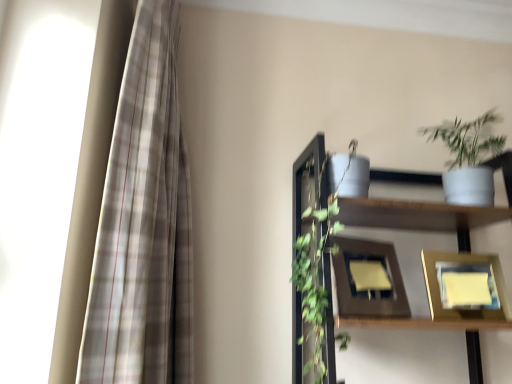
I want to click on wooden picture frame at center, the first picture frame when ordered from left to right, so click(x=368, y=280).

The height and width of the screenshot is (384, 512). What do you see at coordinates (419, 215) in the screenshot?
I see `white matte shelf at upper right` at bounding box center [419, 215].

The width and height of the screenshot is (512, 384). Find the location of `wooden picture frame at center, positioned as the second picture frame in right-to-left order`. wooden picture frame at center, positioned as the second picture frame in right-to-left order is located at coordinates (368, 280).

From a real-world perspective, is white matte shelf at upper right above or below plaid fabric curtain at left?

From a real-world perspective, white matte shelf at upper right is physically below plaid fabric curtain at left.

From the image's perspective, is white matte shelf at upper right over plaid fabric curtain at left?

No, from the image's perspective, white matte shelf at upper right is not over plaid fabric curtain at left.

Can you confirm if white matte shelf at upper right is taller than plaid fabric curtain at left?

Incorrect, the height of white matte shelf at upper right is not larger of that of plaid fabric curtain at left.

Locate an element on the screen. curtain that is above the white matte shelf at upper right (from a real-world perspective) is located at coordinates (143, 223).

Where is `picture frame that is the 2nd object located below the plaid fabric curtain at left (from the image's perspective)`? picture frame that is the 2nd object located below the plaid fabric curtain at left (from the image's perspective) is located at coordinates (465, 286).

Could you tell me if gold metallic picture frame at lower right, positioned as the second picture frame in left-to-right order, is turned towards plaid fabric curtain at left?

No, gold metallic picture frame at lower right, positioned as the second picture frame in left-to-right order, is not aimed at plaid fabric curtain at left.

Which object is closer to the camera taking this photo, gold metallic picture frame at lower right, which is the first picture frame in right-to-left order, or plaid fabric curtain at left?

plaid fabric curtain at left.

Does point (500, 291) come in front of point (142, 371)?

No, it is not.

From the image's perspective, which is above, wooden picture frame at center, positioned as the second picture frame in right-to-left order, or gold metallic picture frame at lower right, which is the first picture frame in right-to-left order?

From the image's view, wooden picture frame at center, positioned as the second picture frame in right-to-left order, is above.

Is wooden picture frame at center, positioned as the second picture frame in right-to-left order, wider or thinner than gold metallic picture frame at lower right, which is the first picture frame in right-to-left order?

Considering their sizes, wooden picture frame at center, positioned as the second picture frame in right-to-left order, looks slimmer than gold metallic picture frame at lower right, which is the first picture frame in right-to-left order.

This screenshot has width=512, height=384. There is a gold metallic picture frame at lower right, which is the first picture frame in right-to-left order. Identify the location of picture frame above it (from a real-world perspective). (368, 280).

Is gold metallic picture frame at lower right, which is the first picture frame in right-to-left order, inside wooden picture frame at center, the first picture frame when ordered from left to right?

No, wooden picture frame at center, the first picture frame when ordered from left to right, does not contain gold metallic picture frame at lower right, which is the first picture frame in right-to-left order.

Are white matte shelf at upper right and wooden picture frame at center, the first picture frame when ordered from left to right, far apart?

They are positioned close to each other.

What's the angular difference between white matte shelf at upper right and wooden picture frame at center, positioned as the second picture frame in right-to-left order,'s facing directions?

The facing directions of white matte shelf at upper right and wooden picture frame at center, positioned as the second picture frame in right-to-left order, are 24 degrees apart.

Does white matte shelf at upper right turn towards wooden picture frame at center, the first picture frame when ordered from left to right?

Yes, white matte shelf at upper right is oriented towards wooden picture frame at center, the first picture frame when ordered from left to right.

Does white matte shelf at upper right contain wooden picture frame at center, the first picture frame when ordered from left to right?

Yes, wooden picture frame at center, the first picture frame when ordered from left to right, is a part of white matte shelf at upper right.

Locate an element on the screen. The height and width of the screenshot is (384, 512). the 1st picture frame below the white matte pot at upper right (from the image's perspective) is located at coordinates (368, 280).

In the scene shown: Considering the relative sizes of wooden picture frame at center, positioned as the second picture frame in right-to-left order, and white matte pot at upper right in the image provided, is wooden picture frame at center, positioned as the second picture frame in right-to-left order, wider than white matte pot at upper right?

No, wooden picture frame at center, positioned as the second picture frame in right-to-left order, is not wider than white matte pot at upper right.

From a real-world perspective, is wooden picture frame at center, the first picture frame when ordered from left to right, below white matte pot at upper right?

Yes, from a real-world perspective, wooden picture frame at center, the first picture frame when ordered from left to right, is beneath white matte pot at upper right.

From the image's perspective, is wooden picture frame at center, positioned as the second picture frame in right-to-left order, on top of white matte pot at upper right?

No, from the image's perspective, wooden picture frame at center, positioned as the second picture frame in right-to-left order, is not on top of white matte pot at upper right.

Considering the sizes of plaid fabric curtain at left and white matte shelf at upper right in the image, is plaid fabric curtain at left taller or shorter than white matte shelf at upper right?

plaid fabric curtain at left is taller than white matte shelf at upper right.

This screenshot has height=384, width=512. I want to click on curtain to the left of white matte shelf at upper right, so click(143, 223).

From a real-world perspective, is plaid fabric curtain at left positioned under white matte shelf at upper right based on gravity?

No, from a real-world perspective, plaid fabric curtain at left is not under white matte shelf at upper right.

From the image's perspective, relative to white matte shelf at upper right, is plaid fabric curtain at left above or below?

Clearly, from the image's perspective, plaid fabric curtain at left is above white matte shelf at upper right.

Find the location of a particular element. The height and width of the screenshot is (384, 512). the 2nd picture frame behind the white matte shelf at upper right is located at coordinates [x=465, y=286].

Which object is thinner, gold metallic picture frame at lower right, which is the first picture frame in right-to-left order, or white matte shelf at upper right?

Thinner between the two is gold metallic picture frame at lower right, which is the first picture frame in right-to-left order.

Which point is more forward, [475,262] or [414,209]?

The point [414,209] is more forward.

This screenshot has height=384, width=512. Find the location of `shelf below the plaid fabric curtain at left (from the image's perspective)`. shelf below the plaid fabric curtain at left (from the image's perspective) is located at coordinates (419, 215).

Find the location of `picture frame that is the 2nd object directly below the plaid fabric curtain at left (from a real-world perspective)`. picture frame that is the 2nd object directly below the plaid fabric curtain at left (from a real-world perspective) is located at coordinates (465, 286).

From the image, which object appears to be farther from plaid fabric curtain at left, white matte pot at upper right or white matte shelf at upper right?

white matte pot at upper right lies further to plaid fabric curtain at left than the other object.

Looking at the image, which one is located further to white matte pot at upper right, gold metallic picture frame at lower right, which is the first picture frame in right-to-left order, or plaid fabric curtain at left?

Among the two, plaid fabric curtain at left is located further to white matte pot at upper right.

Based on their spatial positions, is wooden picture frame at center, the first picture frame when ordered from left to right, or white matte pot at upper right closer to white matte shelf at upper right?

Based on the image, wooden picture frame at center, the first picture frame when ordered from left to right, appears to be nearer to white matte shelf at upper right.

Looking at this image, which object lies further to the anchor point plaid fabric curtain at left, wooden picture frame at center, positioned as the second picture frame in right-to-left order, or white matte pot at upper right?

white matte pot at upper right is positioned further to the anchor plaid fabric curtain at left.

Considering their positions, is gold metallic picture frame at lower right, which is the first picture frame in right-to-left order, positioned closer to white matte shelf at upper right than white matte pot at upper right?

gold metallic picture frame at lower right, which is the first picture frame in right-to-left order, is closer to white matte shelf at upper right.

Based on their spatial positions, is wooden picture frame at center, positioned as the second picture frame in right-to-left order, or white matte shelf at upper right further from plaid fabric curtain at left?

wooden picture frame at center, positioned as the second picture frame in right-to-left order.

From the image, which object appears to be nearer to white matte pot at upper right, gold metallic picture frame at lower right, which is the first picture frame in right-to-left order, or wooden picture frame at center, positioned as the second picture frame in right-to-left order?

The object closer to white matte pot at upper right is gold metallic picture frame at lower right, which is the first picture frame in right-to-left order.

Estimate the real-world distances between objects in this image. Which object is further from white matte pot at upper right, wooden picture frame at center, positioned as the second picture frame in right-to-left order, or plaid fabric curtain at left?

plaid fabric curtain at left.

This screenshot has height=384, width=512. Find the location of `picture frame between white matte shelf at upper right and gold metallic picture frame at lower right, which is the first picture frame in right-to-left order, in the front-back direction`. picture frame between white matte shelf at upper right and gold metallic picture frame at lower right, which is the first picture frame in right-to-left order, in the front-back direction is located at coordinates (368, 280).

Identify the location of shelf between white matte pot at upper right and wooden picture frame at center, positioned as the second picture frame in right-to-left order, in the up-down direction. (419, 215).

Identify the location of shelf between plaid fabric curtain at left and gold metallic picture frame at lower right, which is the first picture frame in right-to-left order, in the horizontal direction. (419, 215).

Locate an element on the screen. shelf between white matte pot at upper right and gold metallic picture frame at lower right, positioned as the second picture frame in left-to-right order, in the vertical direction is located at coordinates (419, 215).